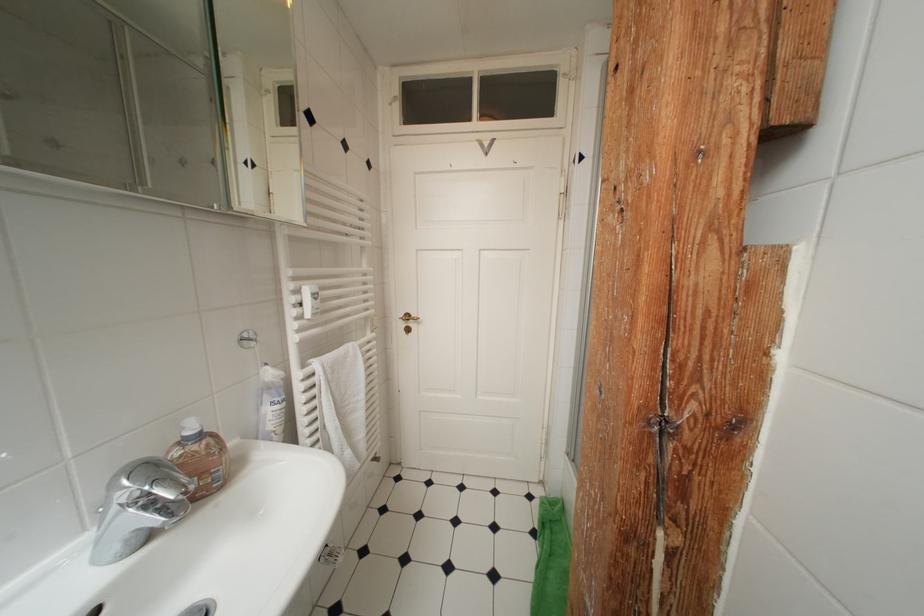
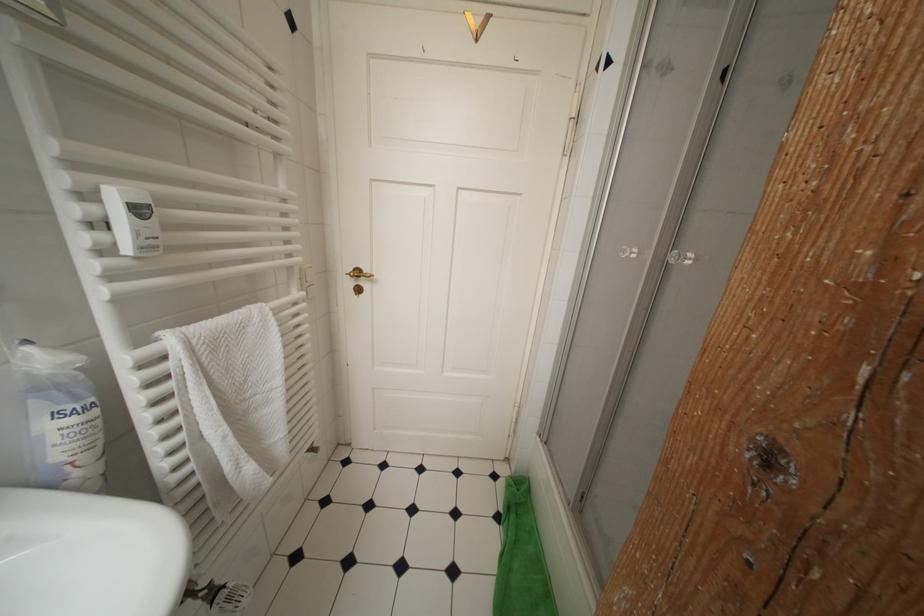
Question: In a continuous first-person perspective shot, in which direction is the camera moving?

Choices:
 (A) Left
 (B) Right
 (C) Forward
 (D) Backward

Answer: (C)